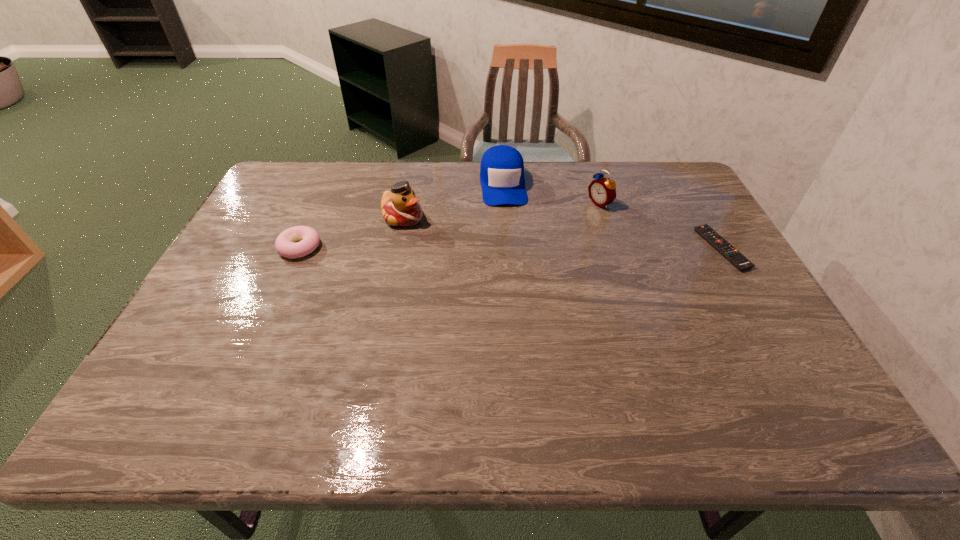
Where is `object located in the left edge section of the desktop`? object located in the left edge section of the desktop is located at coordinates (309, 239).

Locate an element on the screen. Image resolution: width=960 pixels, height=540 pixels. object situated at the right edge is located at coordinates (738, 260).

Locate an element on the screen. The image size is (960, 540). free space at the far edge of the desktop is located at coordinates (472, 177).

You are a GUI agent. You are given a task and a screenshot of the screen. Output one action in this format:
    pyautogui.click(x=<x>, y=<y>)
    Task: Click on the vacant region at the near edge
    This screenshot has width=960, height=540.
    Given the screenshot: What is the action you would take?
    pyautogui.click(x=545, y=370)

Where is `vacant space at the left edge`? vacant space at the left edge is located at coordinates (275, 252).

Locate an element on the screen. vacant region at the right edge of the desktop is located at coordinates (688, 257).

Locate an element on the screen. vacant area that lies between the baseball cap and the second object from right to left is located at coordinates (551, 194).

You are a GUI agent. You are given a task and a screenshot of the screen. Output one action in this format:
    pyautogui.click(x=<x>, y=<y>)
    Task: Click on the vacant region between the second object from right to left and the duck
    
    Given the screenshot: What is the action you would take?
    pyautogui.click(x=501, y=211)

Where is `vacant point located between the remote control and the leftmost object`? The image size is (960, 540). vacant point located between the remote control and the leftmost object is located at coordinates (511, 248).

Image resolution: width=960 pixels, height=540 pixels. Find the location of `vacant space in between the baseball cap and the rightmost object`. vacant space in between the baseball cap and the rightmost object is located at coordinates (612, 217).